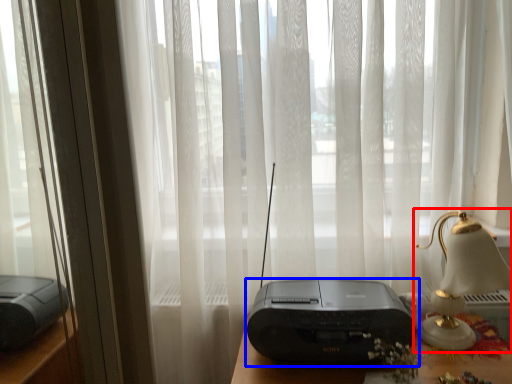
Question: Which point is closer to the camera, bedside lamp (highlighted by a red box) or printer (highlighted by a blue box)?

Choices:
 (A) bedside lamp
 (B) printer

Answer: (A)